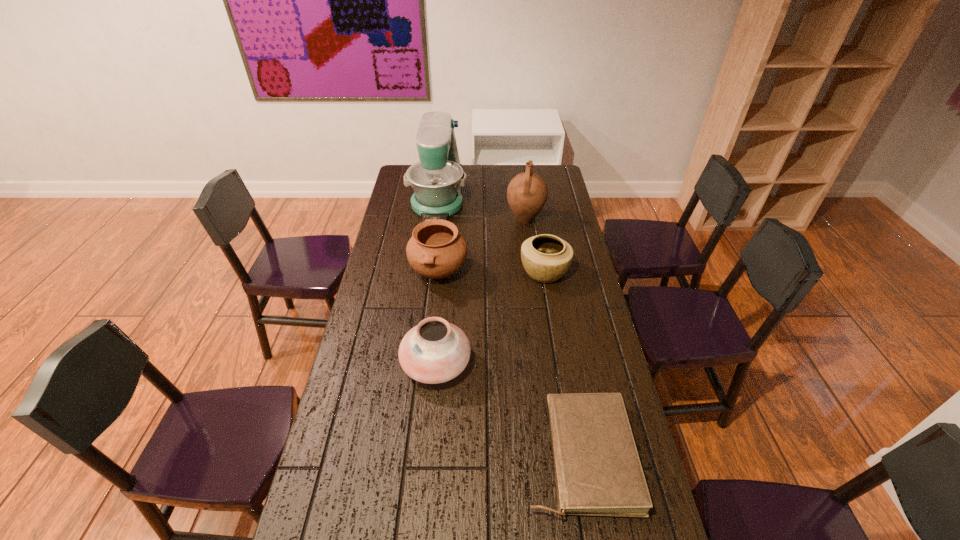
Image resolution: width=960 pixels, height=540 pixels. Find the location of `free spot between the fifth farthest object and the fifth tallest object`. free spot between the fifth farthest object and the fifth tallest object is located at coordinates (491, 318).

Choose which object is the fourth nearest neighbor to the pitcher. Please provide its 2D coordinates. Your answer should be formatted as a tuple, i.e. [(x, y)], where the tuple contains the x and y coordinates of a point satisfying the conditions above.

[(435, 351)]

Identify the location of object that ranks as the second closest to the second shortest object. (436, 250).

The width and height of the screenshot is (960, 540). In order to click on pottery that is the closest to the shortest object in this screenshot , I will do `click(435, 351)`.

At what (x,y) coordinates should I click in order to perform the action: click on pottery that stands as the second closest to the mixer. Please return your answer as a coordinate pair (x, y). This screenshot has width=960, height=540. Looking at the image, I should click on (546, 258).

At what (x,y) coordinates should I click in order to perform the action: click on vacant region that satisfies the following two spatial constraints: 1. on the front-facing side of the pitcher; 2. on the right side of the tallest object. Please return your answer as a coordinate pair (x, y). Looking at the image, I should click on (435, 220).

Image resolution: width=960 pixels, height=540 pixels. I want to click on vacant space that satisfies the following two spatial constraints: 1. on the front-facing side of the rightmost pottery; 2. on the right side of the tallest object, so click(428, 272).

Locate an element on the screen. The height and width of the screenshot is (540, 960). vacant area that satisfies the following two spatial constraints: 1. on the front-facing side of the shortest pottery; 2. on the right side of the tallest object is located at coordinates (428, 272).

Find the location of `free spot that satisfies the following two spatial constraints: 1. on the back side of the second shortest object; 2. on the right side of the nearest pottery`. free spot that satisfies the following two spatial constraints: 1. on the back side of the second shortest object; 2. on the right side of the nearest pottery is located at coordinates (444, 272).